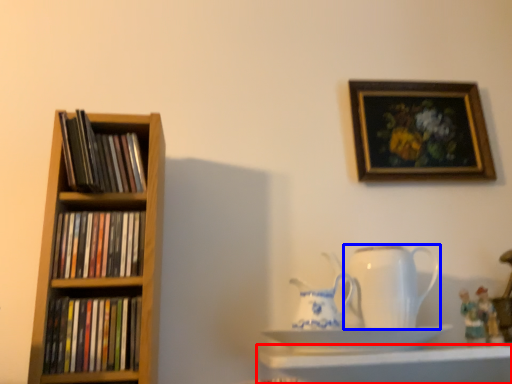
Question: Which object is further to the camera taking this photo, shelf (highlighted by a red box) or jug (highlighted by a blue box)?

Choices:
 (A) shelf
 (B) jug

Answer: (B)